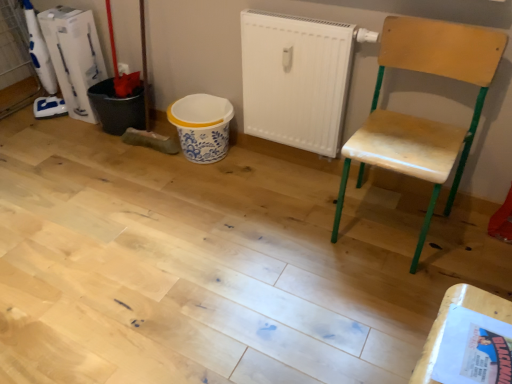
Locate an element on the screen. The image size is (512, 384). vacant space situated above white matte radiator at center (from a real-world perspective) is located at coordinates (306, 16).